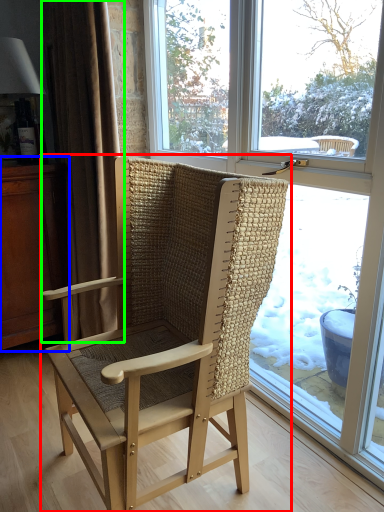
Question: Considering the real-world distances, which object is closest to chair (highlighted by a red box)? dresser (highlighted by a blue box) or curtain (highlighted by a green box).

Choices:
 (A) dresser
 (B) curtain

Answer: (B)